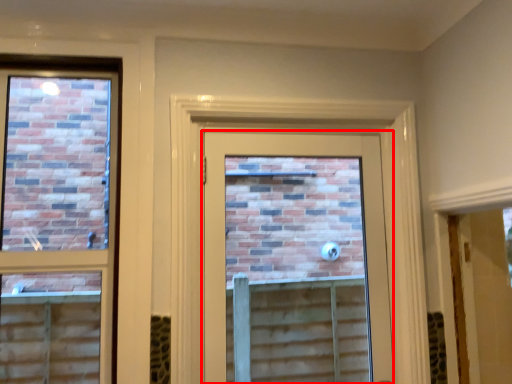
Question: From the image, what is the correct spatial relationship of door (annotated by the red box) in relation to window?

Choices:
 (A) left
 (B) right

Answer: (B)